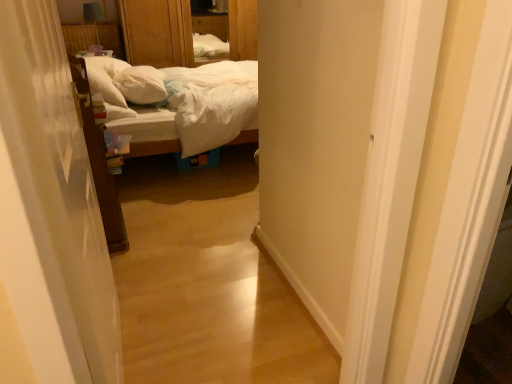
Locate an element on the screen. wooden dresser at upper center is located at coordinates (157, 32).

The image size is (512, 384). What do you see at coordinates (157, 32) in the screenshot?
I see `wooden dresser at upper center` at bounding box center [157, 32].

The width and height of the screenshot is (512, 384). What do you see at coordinates (133, 113) in the screenshot? I see `white soft bed at center` at bounding box center [133, 113].

This screenshot has height=384, width=512. I want to click on white soft pillow at center, so click(141, 85).

Where is `wooden dresser at upper center`? wooden dresser at upper center is located at coordinates (157, 32).

Is white soft pillow at center taller or shorter than white sheer curtain at left?

Considering their sizes, white soft pillow at center has less height than white sheer curtain at left.

Considering the sizes of objects white soft pillow at center and white sheer curtain at left in the image provided, who is bigger, white soft pillow at center or white sheer curtain at left?

Bigger between the two is white sheer curtain at left.

Is there a large distance between white soft pillow at center and white sheer curtain at left?

white soft pillow at center is far away from white sheer curtain at left.

Looking at this image, from the image's perspective, relative to white sheer curtain at left, is white soft pillow at center above or below?

Based on their image positions, white soft pillow at center is located above white sheer curtain at left.

Between white soft bed at center and wooden dresser at upper center, which one has smaller size?

Smaller between the two is wooden dresser at upper center.

Is white soft bed at center aimed at wooden dresser at upper center?

No, white soft bed at center is not facing towards wooden dresser at upper center.

Consider the image. How much distance is there between white soft bed at center and wooden dresser at upper center?

They are 5.12 feet apart.

Can we say white soft bed at center lies outside wooden dresser at upper center?

white soft bed at center is positioned outside wooden dresser at upper center.

Does white sheer curtain at left contain white soft bed at center?

That's incorrect, white soft bed at center is not inside white sheer curtain at left.

Locate an element on the screen. This screenshot has height=384, width=512. bed below the white sheer curtain at left (from a real-world perspective) is located at coordinates (133, 113).

From the image's perspective, relative to white soft bed at center, is white sheer curtain at left above or below?

white sheer curtain at left is below white soft bed at center.

How distant is white soft bed at center from white sheer curtain at left?

1.36 meters.

In terms of height, does white soft bed at center look taller or shorter compared to white sheer curtain at left?

Considering their sizes, white soft bed at center has less height than white sheer curtain at left.

From the image's perspective, which is below, white soft bed at center or white sheer curtain at left?

white sheer curtain at left, from the image's perspective.

Find the location of a particular element. The height and width of the screenshot is (384, 512). curtain above the white soft bed at center (from a real-world perspective) is located at coordinates (52, 206).

Which is more distant, [180,18] or [18,122]?

The point [180,18] is behind.

Considering the positions of objects wooden dresser at upper center and white sheer curtain at left in the image provided, who is more to the left, wooden dresser at upper center or white sheer curtain at left?

Positioned to the left is wooden dresser at upper center.

Is wooden dresser at upper center in front of or behind white sheer curtain at left in the image?

Visually, wooden dresser at upper center is located behind white sheer curtain at left.

Is wooden dresser at upper center smaller than white soft bed at center?

Correct, wooden dresser at upper center occupies less space than white soft bed at center.

Are wooden dresser at upper center and white soft bed at center beside each other?

They are not placed beside each other.

Considering the sizes of objects wooden dresser at upper center and white soft bed at center in the image provided, who is thinner, wooden dresser at upper center or white soft bed at center?

wooden dresser at upper center.

This screenshot has width=512, height=384. I want to click on bed on the right side of wooden dresser at upper center, so click(133, 113).

Which object is wider, white soft pillow at center or wooden dresser at upper center?

Wider between the two is wooden dresser at upper center.

Is white soft pillow at center oriented towards wooden dresser at upper center?

No, white soft pillow at center does not turn towards wooden dresser at upper center.

This screenshot has width=512, height=384. Find the location of `dresser located above the white soft pillow at center (from a real-world perspective)`. dresser located above the white soft pillow at center (from a real-world perspective) is located at coordinates (157, 32).

Is white soft pillow at center bigger than wooden dresser at upper center?

Actually, white soft pillow at center might be smaller than wooden dresser at upper center.

Identify the location of pillow behind the white sheer curtain at left. (141, 85).

In the image, there is a white soft bed at center. What are the coordinates of `dresser above it (from the image's perspective)` in the screenshot? It's located at (157, 32).

Which object lies nearer to the anchor point white soft pillow at center, white sheer curtain at left or white soft bed at center?

white soft bed at center.

Considering their positions, is white soft pillow at center positioned closer to white sheer curtain at left than wooden dresser at upper center?

Among the two, white soft pillow at center is located nearer to white sheer curtain at left.

From the image, which object appears to be nearer to white sheer curtain at left, white soft bed at center or wooden dresser at upper center?

white soft bed at center.

Which object lies nearer to the anchor point white sheer curtain at left, white soft bed at center or white soft pillow at center?

Among the two, white soft bed at center is located nearer to white sheer curtain at left.

Estimate the real-world distances between objects in this image. Which object is further from wooden dresser at upper center, white soft pillow at center or white soft bed at center?

white soft bed at center is further to wooden dresser at upper center.

When comparing their distances from white sheer curtain at left, does wooden dresser at upper center or white soft bed at center seem further?

wooden dresser at upper center.

Considering their positions, is wooden dresser at upper center positioned further to white soft bed at center than white soft pillow at center?

wooden dresser at upper center is further to white soft bed at center.

Based on their spatial positions, is wooden dresser at upper center or white sheer curtain at left further from white soft pillow at center?

white sheer curtain at left is positioned further to the anchor white soft pillow at center.

Locate an element on the screen. The width and height of the screenshot is (512, 384). bed between white sheer curtain at left and wooden dresser at upper center along the z-axis is located at coordinates (133, 113).

This screenshot has height=384, width=512. What are the coordinates of `pillow between white sheer curtain at left and wooden dresser at upper center in the front-back direction` in the screenshot? It's located at (141, 85).

At what (x,y) coordinates should I click in order to perform the action: click on pillow between white soft bed at center and wooden dresser at upper center in the front-back direction. Please return your answer as a coordinate pair (x, y). This screenshot has height=384, width=512. Looking at the image, I should click on (141, 85).

Find the location of `bed between white sheer curtain at left and white soft pillow at center along the z-axis`. bed between white sheer curtain at left and white soft pillow at center along the z-axis is located at coordinates (133, 113).